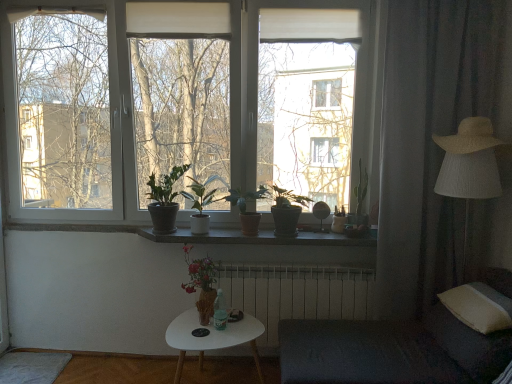
This screenshot has width=512, height=384. I want to click on vacant point above white metallic radiator at center (from a real-world perspective), so click(x=281, y=259).